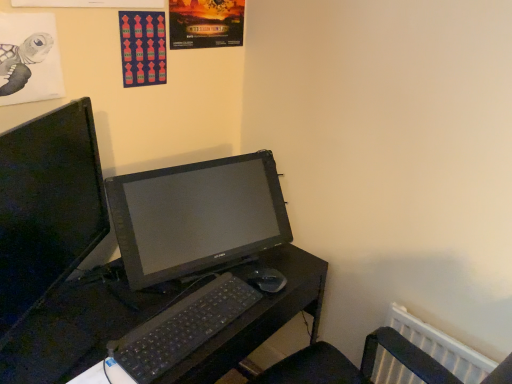
Question: Is black plastic desk at center in front of red fabric poster at upper center, acting as the second poster page starting from the left?

Choices:
 (A) no
 (B) yes

Answer: (B)

Question: From the image's perspective, would you say black plastic desk at center is positioned over red fabric poster at upper center, placed as the second poster page when sorted from right to left?

Choices:
 (A) yes
 (B) no

Answer: (B)

Question: Is black plastic desk at center oriented towards red fabric poster at upper center, placed as the second poster page when sorted from right to left?

Choices:
 (A) no
 (B) yes

Answer: (A)

Question: Does black plastic desk at center have a greater width compared to red fabric poster at upper center, acting as the second poster page starting from the left?

Choices:
 (A) yes
 (B) no

Answer: (A)

Question: Is black plastic desk at center shorter than red fabric poster at upper center, placed as the second poster page when sorted from right to left?

Choices:
 (A) yes
 (B) no

Answer: (B)

Question: From the image's perspective, relative to matte black monitor at left, is matte paper poster at upper center, positioned as the third poster page in left-to-right order, above or below?

Choices:
 (A) below
 (B) above

Answer: (B)

Question: Relative to matte black monitor at left, is matte paper poster at upper center, positioned as the third poster page in left-to-right order, in front or behind?

Choices:
 (A) front
 (B) behind

Answer: (B)

Question: Based on their positions, is matte paper poster at upper center, positioned as the third poster page in left-to-right order, located to the left or right of matte black monitor at left?

Choices:
 (A) left
 (B) right

Answer: (B)

Question: Which is correct: matte paper poster at upper center, marked as the 1th poster page in a right-to-left arrangement, is inside matte black monitor at left, or outside of it?

Choices:
 (A) outside
 (B) inside

Answer: (A)

Question: From a real-world perspective, is black plastic desk at center physically located above or below black plastic mouse at lower center?

Choices:
 (A) below
 (B) above

Answer: (A)

Question: Is black plastic desk at center situated inside black plastic mouse at lower center or outside?

Choices:
 (A) inside
 (B) outside

Answer: (B)

Question: Based on their positions, is black plastic desk at center located to the left or right of black plastic mouse at lower center?

Choices:
 (A) left
 (B) right

Answer: (A)

Question: From their relative heights in the image, would you say black plastic desk at center is taller or shorter than black plastic mouse at lower center?

Choices:
 (A) short
 (B) tall

Answer: (B)

Question: Considering the positions of red fabric poster at upper center, acting as the second poster page starting from the left, and black plastic mouse at lower center in the image, is red fabric poster at upper center, acting as the second poster page starting from the left, wider or thinner than black plastic mouse at lower center?

Choices:
 (A) wide
 (B) thin

Answer: (B)

Question: In the image, is red fabric poster at upper center, acting as the second poster page starting from the left, on the left side or the right side of black plastic mouse at lower center?

Choices:
 (A) right
 (B) left

Answer: (B)